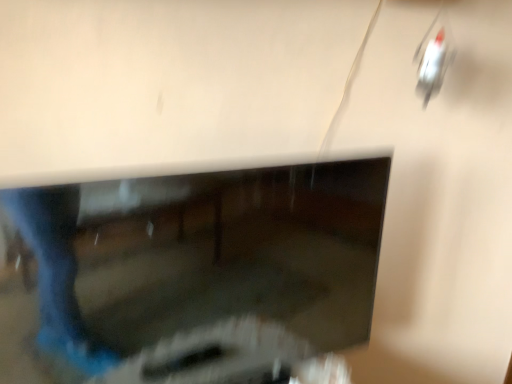
Where is `matte black television at center`? Image resolution: width=512 pixels, height=384 pixels. matte black television at center is located at coordinates (189, 273).

What do you see at coordinates (189, 273) in the screenshot? I see `matte black television at center` at bounding box center [189, 273].

Find the location of a particular element. The image size is (512, 384). matte black television at center is located at coordinates (189, 273).